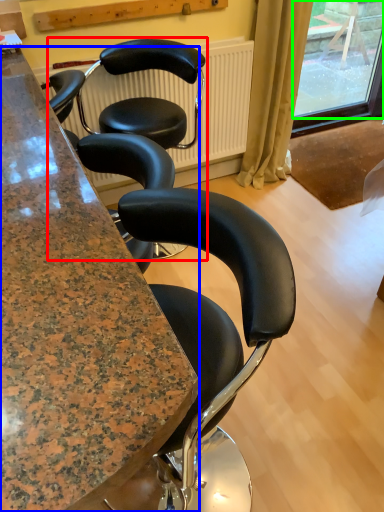
Question: Which is farther away from chair (highlighted by a red box)? cabinetry (highlighted by a blue box) or window screen (highlighted by a green box)?

Choices:
 (A) cabinetry
 (B) window screen

Answer: (B)